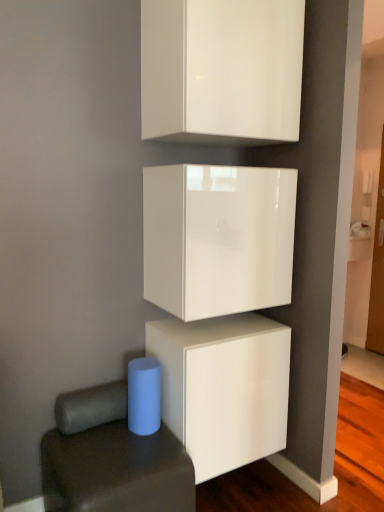
At what (x,y) coordinates should I click in order to perform the action: click on vacant space situated above white glossy cabinet at lower center, the third cabinetry in the top-to-bottom sequence (from a real-world perspective). Please return your answer as a coordinate pair (x, y). The height and width of the screenshot is (512, 384). Looking at the image, I should click on (213, 325).